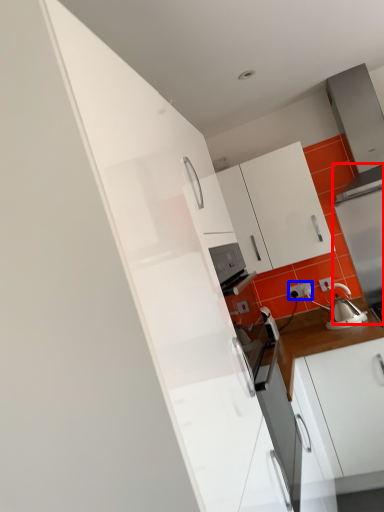
Question: Which object appears farthest to the camera in this image, appliance (highlighted by a red box) or electric outlet (highlighted by a blue box)?

Choices:
 (A) appliance
 (B) electric outlet

Answer: (B)